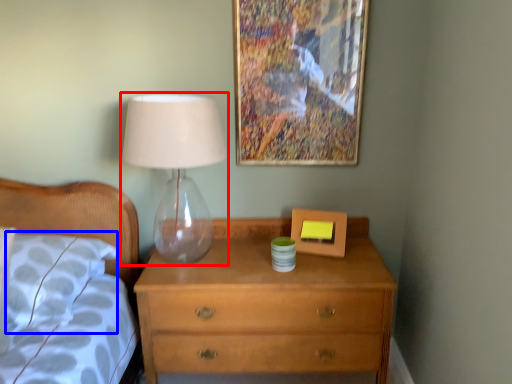
Question: Which point is further to the camera, table lamp (highlighted by a red box) or pillow (highlighted by a blue box)?

Choices:
 (A) table lamp
 (B) pillow

Answer: (B)